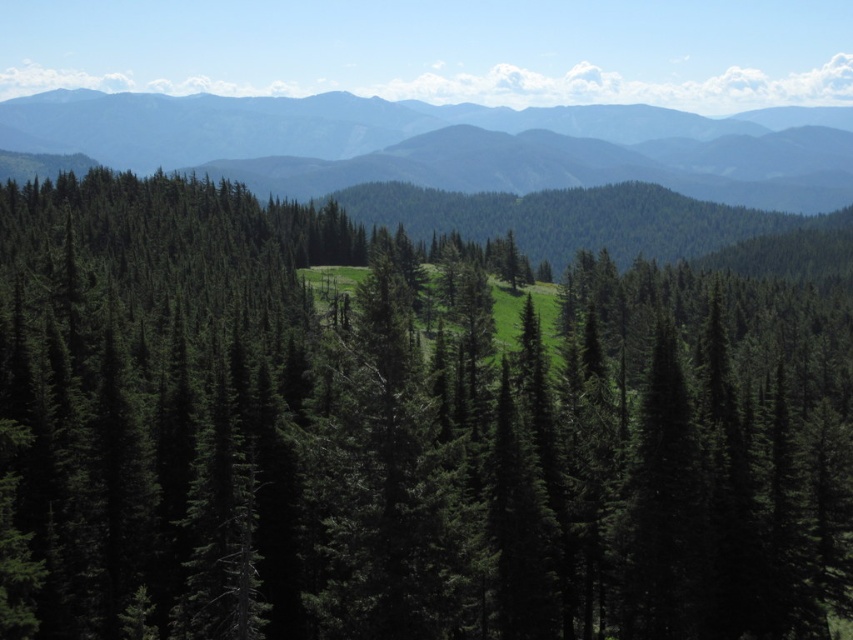
Can you confirm if green matte tree at center is positioned to the right of green forested mountain range at upper center?

Yes, green matte tree at center is to the right of green forested mountain range at upper center.

Between green matte tree at center and green forested mountain range at upper center, which one is positioned lower?

green matte tree at center is lower down.

I want to click on green matte tree at center, so tap(399, 435).

What are the coordinates of `green matte tree at center` in the screenshot? It's located at click(399, 435).